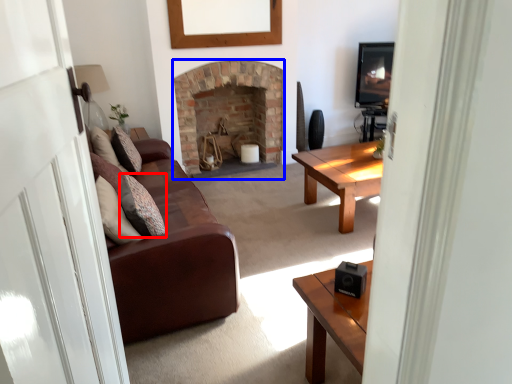
Question: Which of the following is the farthest to the observer, pillow (highlighted by a red box) or fireplace (highlighted by a blue box)?

Choices:
 (A) pillow
 (B) fireplace

Answer: (B)